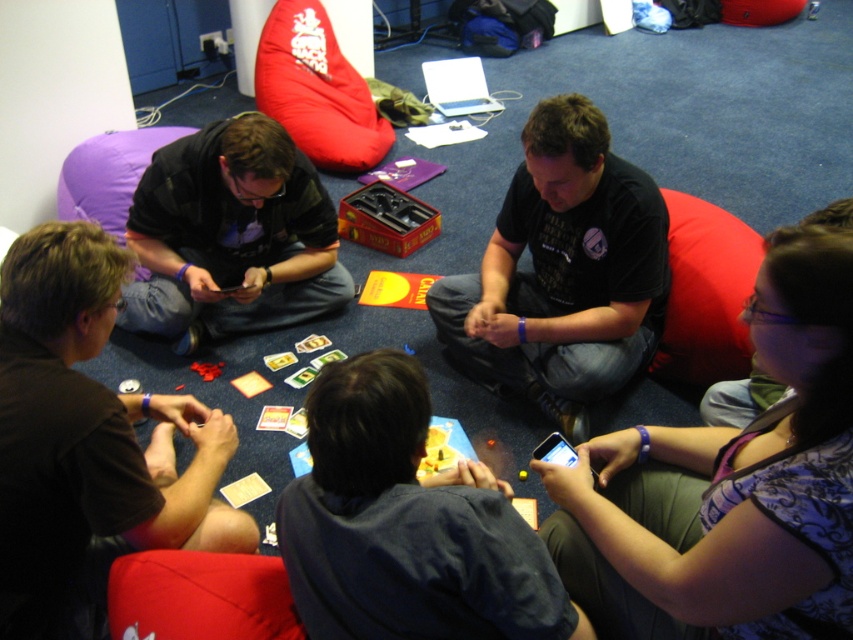
Does black matte shirt at center appear on the right side of matte black shirt at left?

Indeed, black matte shirt at center is positioned on the right side of matte black shirt at left.

How much distance is there between black matte shirt at center and matte black shirt at left?

black matte shirt at center is 26.03 inches away from matte black shirt at left.

The height and width of the screenshot is (640, 853). What are the coordinates of `black matte shirt at center` in the screenshot? It's located at (561, 273).

I want to click on black matte shirt at center, so click(561, 273).

Does brown matte shirt at lower left appear on the right side of black matte shirt at center?

In fact, brown matte shirt at lower left is to the left of black matte shirt at center.

Does point (33, 342) lie behind point (541, 173)?

That is False.

At what (x,y) coordinates should I click in order to perform the action: click on brown matte shirt at lower left. Please return your answer as a coordinate pair (x, y). Looking at the image, I should click on (88, 444).

Can you confirm if purple fabric at lower right is shorter than black matte shirt at center?

Yes, purple fabric at lower right is shorter than black matte shirt at center.

Who is more distant from viewer, (x=775, y=296) or (x=619, y=376)?

The point (x=619, y=376) is behind.

Between point (704, 600) and point (514, 216), which one is positioned in front?

Positioned in front is point (704, 600).

Where is `purple fabric at lower right`? purple fabric at lower right is located at coordinates (730, 484).